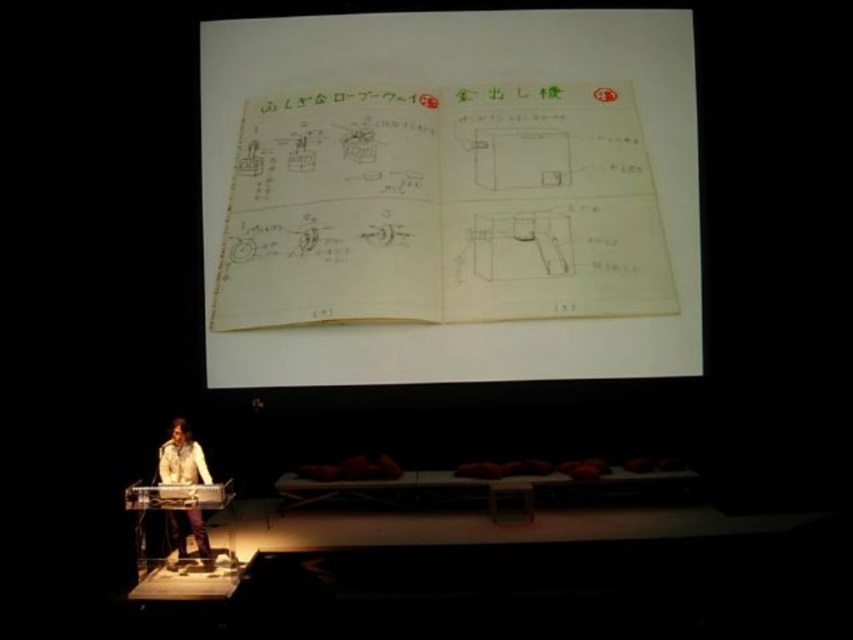
Question: Is yellow paper notebook at center bigger than light brown leather jacket at lower left?

Choices:
 (A) yes
 (B) no

Answer: (A)

Question: Among these objects, which one is nearest to the camera?

Choices:
 (A) yellow paper notebook at center
 (B) light brown leather jacket at lower left

Answer: (B)

Question: Is the position of yellow paper notebook at center less distant than that of light brown leather jacket at lower left?

Choices:
 (A) no
 (B) yes

Answer: (A)

Question: Can you confirm if yellow paper notebook at center is positioned to the right of light brown leather jacket at lower left?

Choices:
 (A) no
 (B) yes

Answer: (B)

Question: Which object appears farthest from the camera in this image?

Choices:
 (A) light brown leather jacket at lower left
 (B) yellow paper notebook at center

Answer: (B)